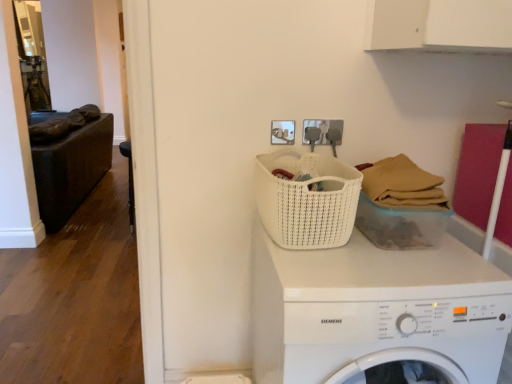
Question: Does white woven basket at center, placed as the first basket when sorted from left to right, have a lesser height compared to white woven basket at center, which is counted as the first basket, starting from the right?

Choices:
 (A) yes
 (B) no

Answer: (B)

Question: Is the position of white woven basket at center, which is counted as the second basket, starting from the right, more distant than that of white woven basket at center, which is counted as the first basket, starting from the right?

Choices:
 (A) yes
 (B) no

Answer: (B)

Question: Is white woven basket at center, placed as the first basket when sorted from left to right, to the right of white woven basket at center, which is the second basket in left-to-right order, from the viewer's perspective?

Choices:
 (A) yes
 (B) no

Answer: (B)

Question: Is white woven basket at center, placed as the first basket when sorted from left to right, looking in the opposite direction of white woven basket at center, which is the second basket in left-to-right order?

Choices:
 (A) yes
 (B) no

Answer: (B)

Question: From a real-world perspective, is white woven basket at center, placed as the first basket when sorted from left to right, over white woven basket at center, which is the second basket in left-to-right order?

Choices:
 (A) yes
 (B) no

Answer: (A)

Question: Is white woven basket at center, which is counted as the second basket, starting from the right, situated inside black leather chair at left or outside?

Choices:
 (A) inside
 (B) outside

Answer: (B)

Question: In terms of width, does white woven basket at center, placed as the first basket when sorted from left to right, look wider or thinner when compared to black leather chair at left?

Choices:
 (A) thin
 (B) wide

Answer: (B)

Question: Is point (322, 213) closer or farther from the camera than point (134, 226)?

Choices:
 (A) closer
 (B) farther

Answer: (A)

Question: From the image's perspective, is white woven basket at center, placed as the first basket when sorted from left to right, positioned above or below black leather chair at left?

Choices:
 (A) above
 (B) below

Answer: (B)

Question: Is point (121, 152) closer or farther from the camera than point (348, 183)?

Choices:
 (A) farther
 (B) closer

Answer: (A)

Question: From their relative heights in the image, would you say black leather chair at left is taller or shorter than white woven basket at center, placed as the first basket when sorted from left to right?

Choices:
 (A) tall
 (B) short

Answer: (A)

Question: From the image's perspective, relative to white woven basket at center, which is counted as the second basket, starting from the right, is black leather chair at left above or below?

Choices:
 (A) below
 (B) above

Answer: (B)

Question: Would you say black leather chair at left is inside or outside white woven basket at center, placed as the first basket when sorted from left to right?

Choices:
 (A) outside
 (B) inside

Answer: (A)

Question: From a real-world perspective, is white plastic washing machine at center positioned above or below black leather chair at left?

Choices:
 (A) below
 (B) above

Answer: (B)

Question: Is white plastic washing machine at center inside or outside of black leather chair at left?

Choices:
 (A) inside
 (B) outside

Answer: (B)